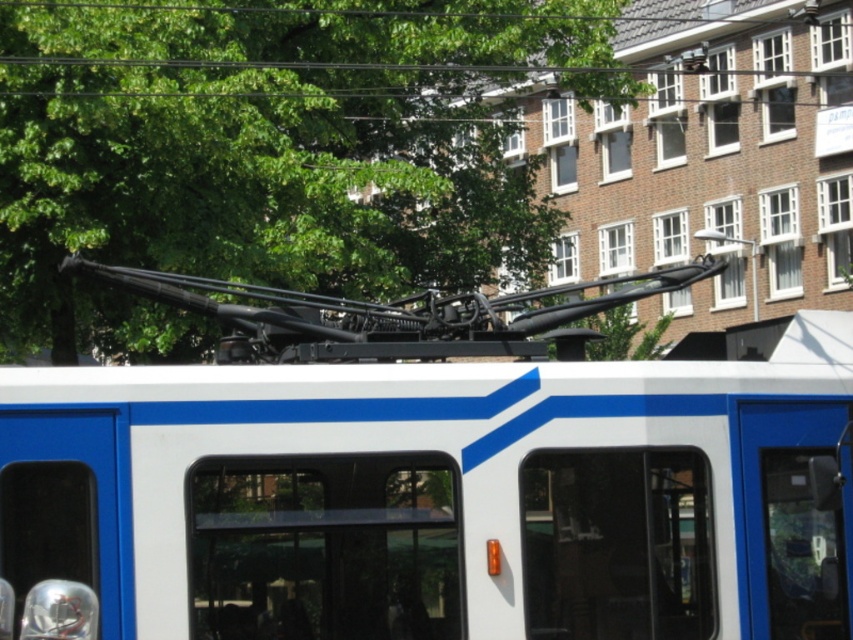
Based on the scene description, where is the white matte train at center located in terms of its 2D coordinates?

The white matte train at center is located at the 2D coordinates of point (426, 477).

You are a passenger on the tram and want to know which of the two points, point (235, 493) or point (469, 275), is nearer to you. Which one is closer?

Point (235, 493) is closer to the camera than point (469, 275), so it is the closer one.